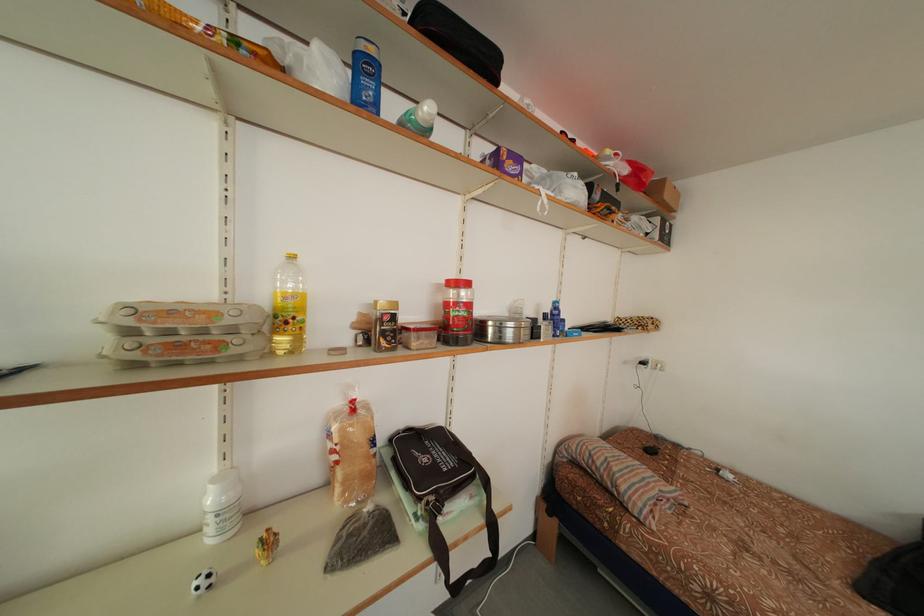
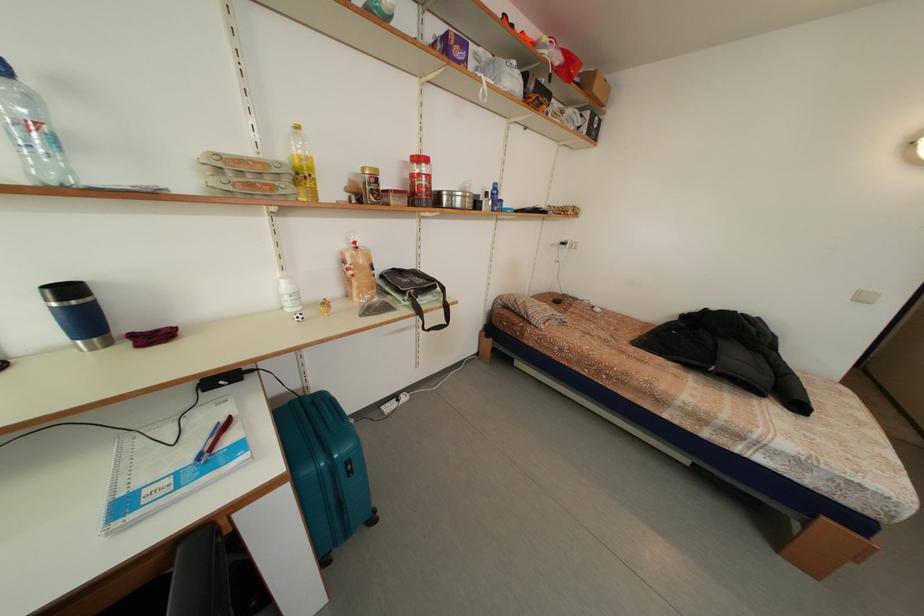
Where in the second image is the point corresponding to (x=527, y=166) from the first image?

(472, 51)